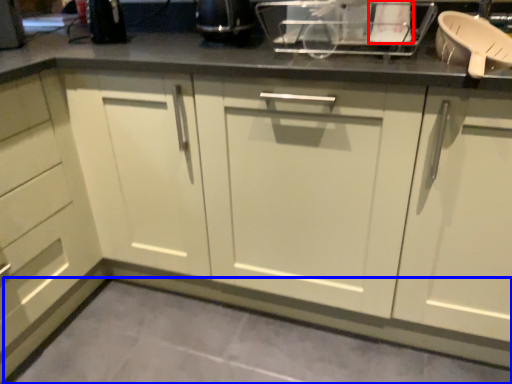
Question: Which object appears farthest to the camera in this image, appliance (highlighted by a red box) or concrete (highlighted by a blue box)?

Choices:
 (A) appliance
 (B) concrete

Answer: (A)